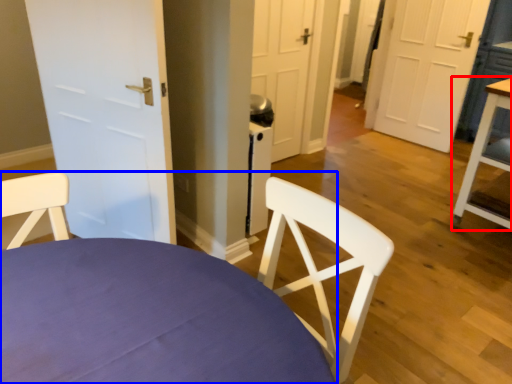
Question: Which point is further to the camera, table (highlighted by a red box) or chair (highlighted by a blue box)?

Choices:
 (A) table
 (B) chair

Answer: (A)